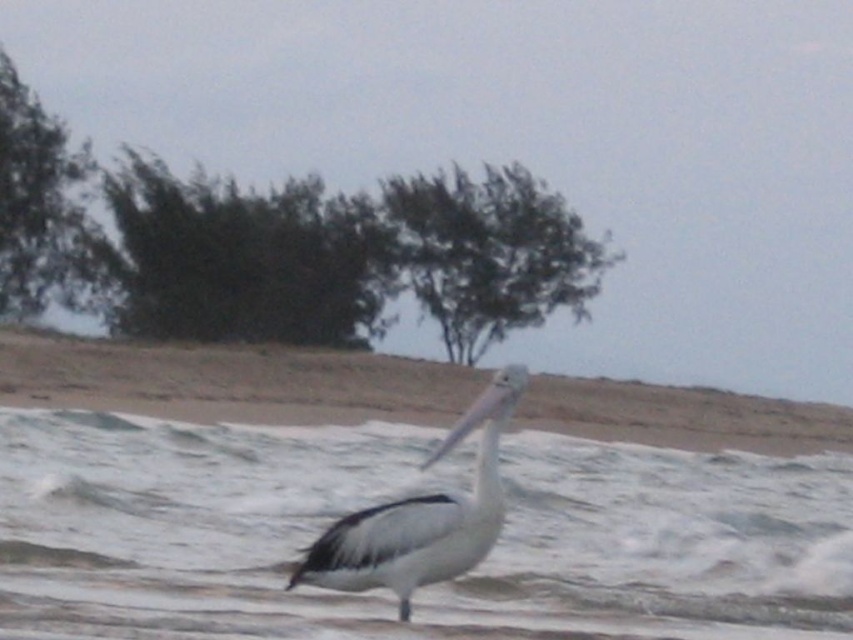
Question: Does beige sandy beach at lower center appear over dark green leafy tree at upper center?

Choices:
 (A) no
 (B) yes

Answer: (A)

Question: Can you confirm if white smooth water at center is positioned above green leafy tree at center?

Choices:
 (A) yes
 (B) no

Answer: (B)

Question: Which point is farther to the camera?

Choices:
 (A) dark green leafy tree at upper center
 (B) white matte pelican at center
 (C) green leafy tree at upper left
 (D) green leafy tree at center

Answer: (D)

Question: Does green leafy tree at center appear over white matte pelican at center?

Choices:
 (A) yes
 (B) no

Answer: (A)

Question: Which of the following is the farthest from the observer?

Choices:
 (A) (97, 385)
 (B) (735, 561)

Answer: (A)

Question: Which of the following is the closest to the observer?

Choices:
 (A) white matte pelican at center
 (B) green leafy tree at center
 (C) white smooth water at center

Answer: (A)